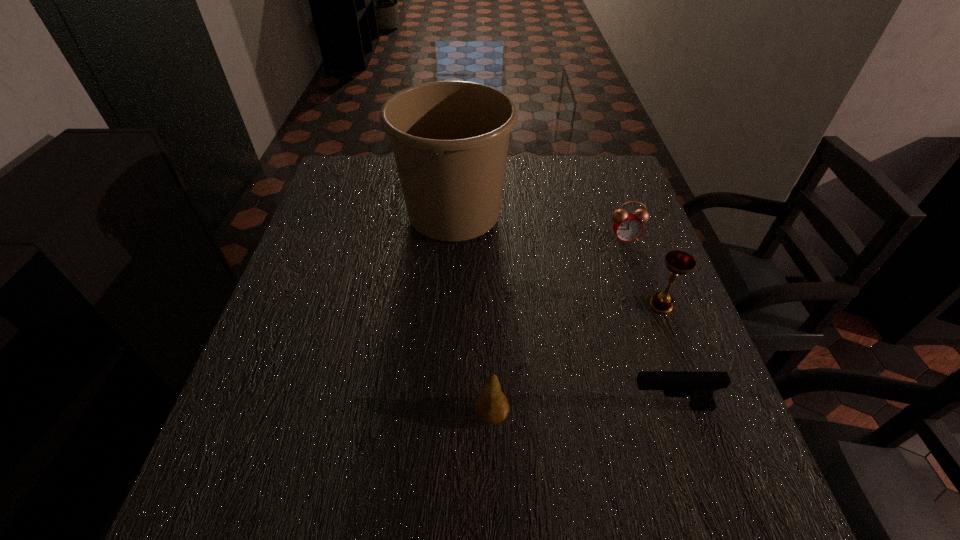
Where is `blank space at the right edge of the desktop`? The height and width of the screenshot is (540, 960). blank space at the right edge of the desktop is located at coordinates (643, 333).

The height and width of the screenshot is (540, 960). Find the location of `vacant space at the far right corner of the desktop`. vacant space at the far right corner of the desktop is located at coordinates (599, 187).

Find the location of a particular element. The image size is (960, 540). free space between the pistol and the pear is located at coordinates (581, 410).

The width and height of the screenshot is (960, 540). I want to click on free space between the pear and the alarm clock, so click(x=558, y=326).

Where is `vacant area that lies between the alarm clock and the pear`? vacant area that lies between the alarm clock and the pear is located at coordinates (558, 326).

At what (x,y) coordinates should I click in order to perform the action: click on free space between the fourth shortest object and the bucket. Please return your answer as a coordinate pair (x, y). The height and width of the screenshot is (540, 960). Looking at the image, I should click on (558, 259).

Locate an element on the screen. The height and width of the screenshot is (540, 960). free spot between the alarm clock and the pistol is located at coordinates (647, 322).

Locate an element on the screen. free area in between the third farthest object and the alarm clock is located at coordinates click(642, 272).

Identify the location of empty location between the pear and the pistol. (581, 410).

You are a GUI agent. You are given a task and a screenshot of the screen. Output one action in this format:
    pyautogui.click(x=<x>, y=<y>)
    Task: Click on the free point between the pistol and the alarm clock
    The height and width of the screenshot is (540, 960).
    Given the screenshot: What is the action you would take?
    pyautogui.click(x=647, y=322)